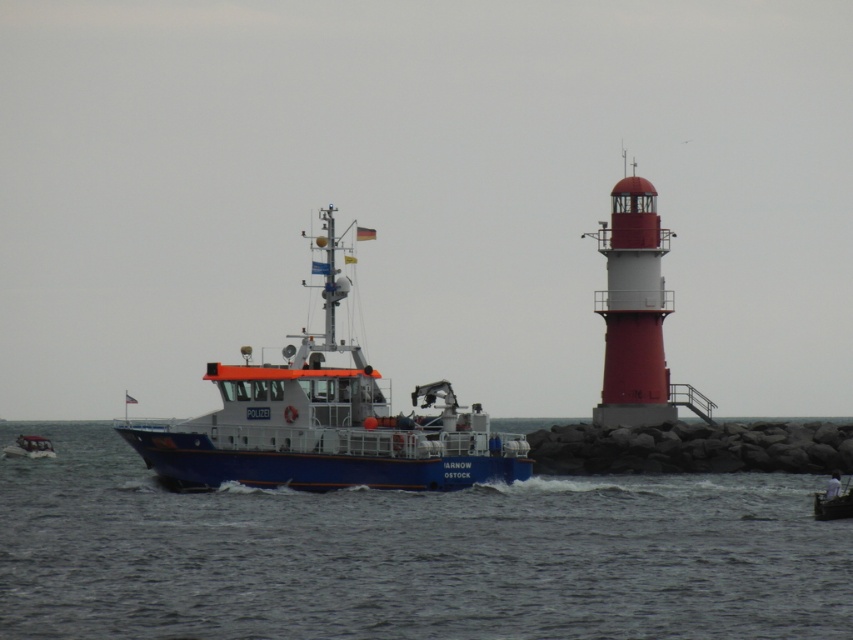
Does blue matte boat at left have a larger size compared to metallic blue boat at center?

Yes.

Which is in front, point (372, 392) or point (846, 484)?

Positioned in front is point (846, 484).

This screenshot has width=853, height=640. I want to click on blue matte boat at left, so click(325, 422).

Between blue metallic water at center and white plastic boat at lower left, which one has more height?

Standing taller between the two is blue metallic water at center.

Is point (421, 508) closer to viewer compared to point (42, 440)?

Yes, point (421, 508) is in front of point (42, 440).

At what (x,y) coordinates should I click in order to perform the action: click on blue metallic water at center. Please return your answer as a coordinate pair (x, y). This screenshot has height=640, width=853. Looking at the image, I should click on (409, 554).

Measure the distance between metallic blue boat at center and white plastic boat at lower left.

metallic blue boat at center and white plastic boat at lower left are 58.91 meters apart from each other.

Can you confirm if metallic blue boat at center is shorter than white plastic boat at lower left?

No.

Who is more distant from viewer, [837,516] or [27,442]?

Point [27,442]

Find the location of a particular element. The width and height of the screenshot is (853, 640). metallic blue boat at center is located at coordinates (833, 500).